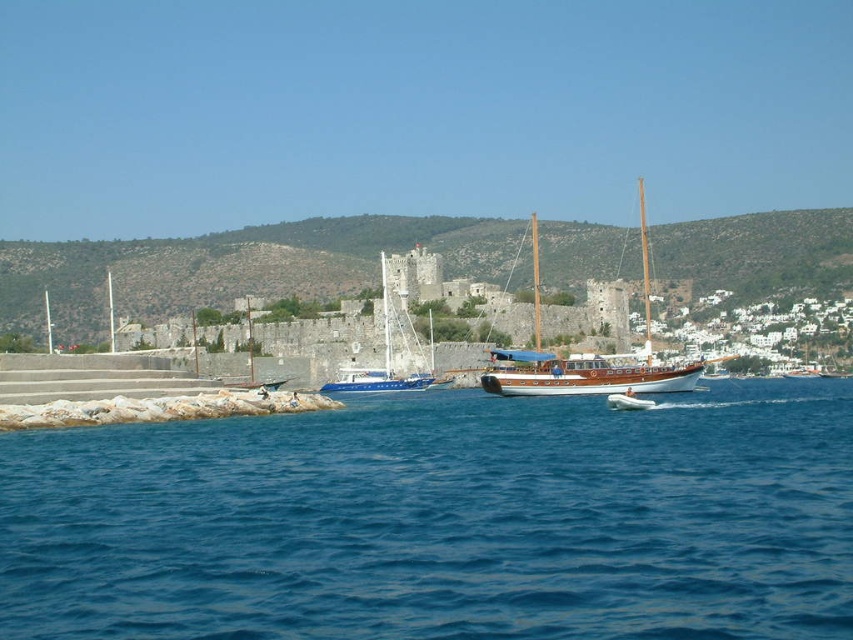
Based on the coordinates provided in the scene description, where is the blue water at center located?

The blue water at center is located at point coordinates [440,520].